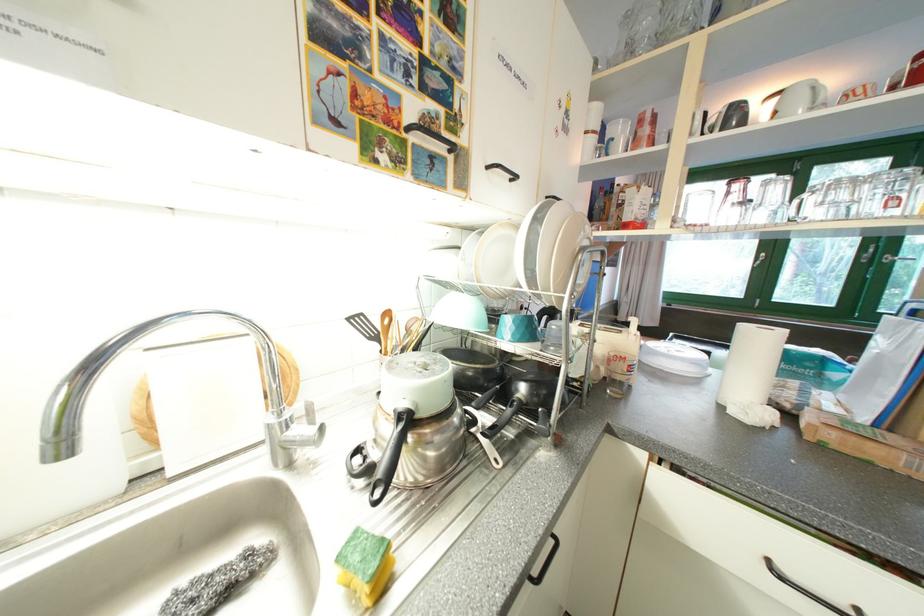
The width and height of the screenshot is (924, 616). What do you see at coordinates (302, 432) in the screenshot? I see `the faucet handle` at bounding box center [302, 432].